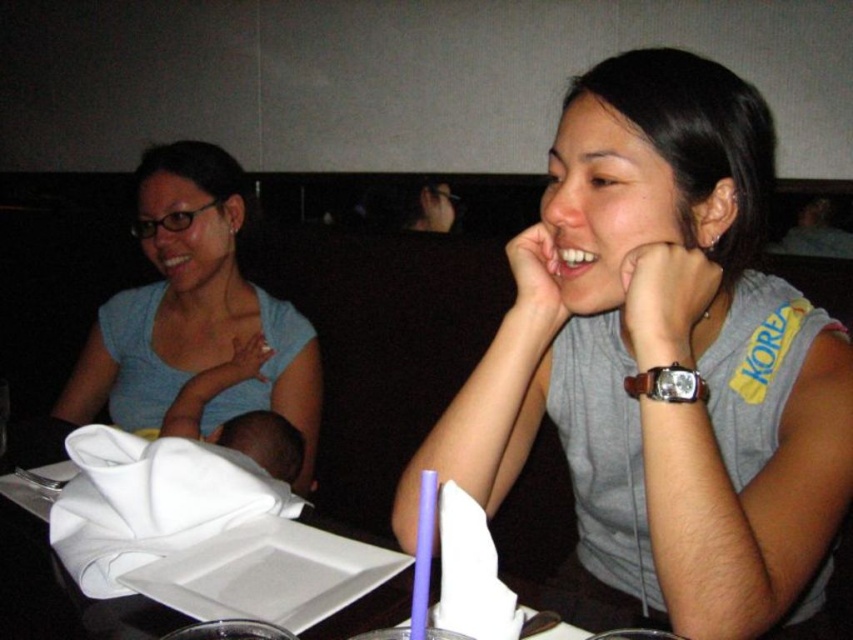
You are a photographer trying to capture a closeup of the two points in the image. The first point is at coordinate point [225,177] and the second is at point [39,492]. Since you want to focus on the one closer to you, which coordinate should you aim your camera at?

Point [225,177] is further to the viewer than point [39,492], so you should aim your camera at point [225,177] to focus on the one closer to you.

You are a photographer trying to capture a closeup of the gray fabric shirt at center and the white paper napkin at center. Based on their sizes, which object should you focus on first to ensure it fits within your camera frame?

The gray fabric shirt at center might be wider than white paper napkin at center, so you should focus on the gray fabric shirt at center first to ensure it fits within your camera frame.

You are a photographer trying to capture a candid shot of both the gray fabric shirt at center and the matte blue shirt at left. Since you can only focus on one subject at a time, which shirt should you focus on to ensure the other is still in the frame?

The gray fabric shirt at center is below matte blue shirt at left, so focusing on the matte blue shirt at left would keep the gray fabric shirt at center within the frame as it is positioned below.